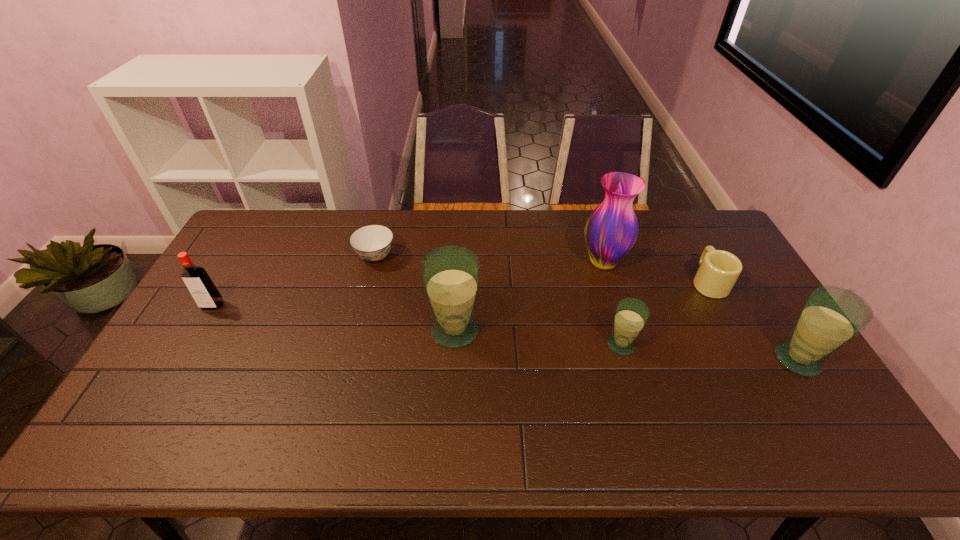
At what (x,y) coordinates should I click in order to perform the action: click on vacant region at the far left corner of the desktop. Please return your answer as a coordinate pair (x, y). Looking at the image, I should click on (265, 219).

In order to click on vacant space at the near right corner of the desktop in this screenshot , I will do `click(811, 407)`.

Locate an element on the screen. Image resolution: width=960 pixels, height=540 pixels. free space between the shortest object and the sixth object from left to right is located at coordinates (541, 269).

You are a GUI agent. You are given a task and a screenshot of the screen. Output one action in this format:
    pyautogui.click(x=<x>, y=<y>)
    Task: Click on the free space between the tallest object and the vodka
    
    Given the screenshot: What is the action you would take?
    pyautogui.click(x=408, y=284)

I want to click on vacant area that lies between the sixth object from right to left and the third object from left to right, so click(x=415, y=293).

Identify the location of free area in between the soup bowl and the shortest glass. This screenshot has width=960, height=540. (498, 300).

In order to click on free space that is in between the sixth object from left to right and the fifth object from right to left in this screenshot , I will do `click(582, 306)`.

Image resolution: width=960 pixels, height=540 pixels. Find the location of `vacant region between the shortest object and the vase`. vacant region between the shortest object and the vase is located at coordinates (490, 259).

I want to click on vacant area that lies between the vase and the sixth tallest object, so click(x=656, y=272).

This screenshot has height=540, width=960. What are the coordinates of `vacant point located between the fourth nearest object and the sixth object from right to left` in the screenshot? It's located at (294, 281).